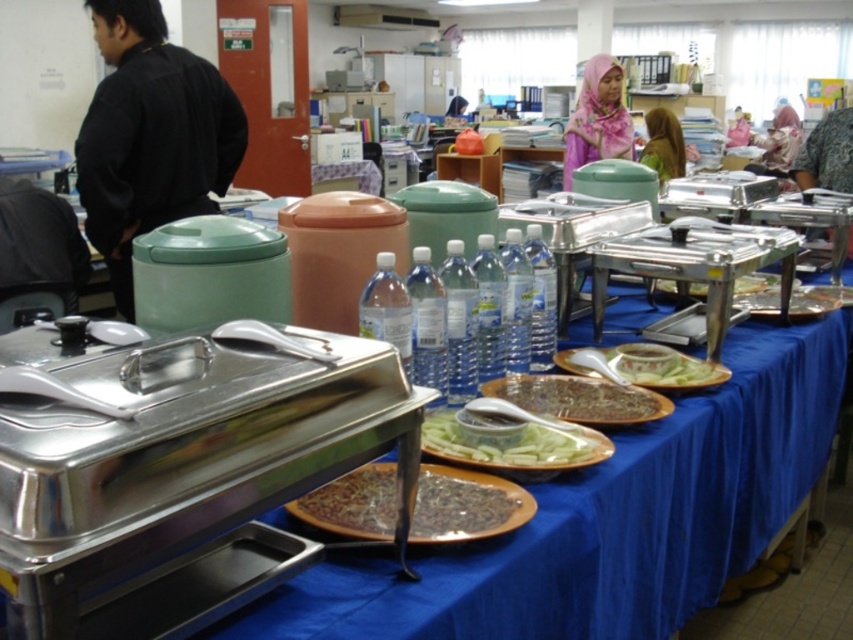
You are at a buffet table and need to grab a drink. There are two fabrics on the table, a brown fabric hijab at upper center and a pink fabric at upper center. Which fabric is closer to you?

The brown fabric hijab at upper center is closer to you than the pink fabric at upper center.

You are standing at the entrance of the room and want to reach the blue fabric tablecloth at center. Which direction should you walk to get there?

Since the blue fabric tablecloth at center is located at point (608, 518), you should walk towards the center of the room to reach it.